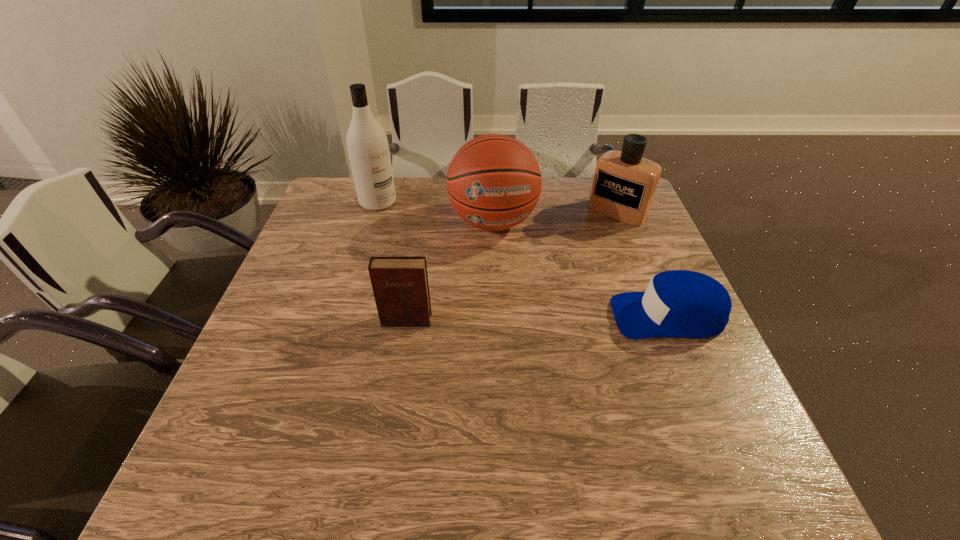
Where is `basketball positioned at the far edge`? basketball positioned at the far edge is located at coordinates (494, 181).

The width and height of the screenshot is (960, 540). In order to click on perfume located at the far edge in this screenshot , I will do pos(624,185).

This screenshot has width=960, height=540. I want to click on shampoo present at the far edge, so click(368, 149).

Where is `object positioned at the left edge`? The width and height of the screenshot is (960, 540). object positioned at the left edge is located at coordinates (368, 149).

At what (x,y) coordinates should I click in order to perform the action: click on baseball cap situated at the right edge. Please return your answer as a coordinate pair (x, y). This screenshot has height=540, width=960. Looking at the image, I should click on (678, 303).

At what (x,y) coordinates should I click in order to perform the action: click on perfume that is at the right edge. Please return your answer as a coordinate pair (x, y). The image size is (960, 540). Looking at the image, I should click on (624, 185).

The height and width of the screenshot is (540, 960). I want to click on object at the far left corner, so click(368, 149).

What are the coordinates of `object that is at the far right corner` in the screenshot? It's located at (624, 185).

Image resolution: width=960 pixels, height=540 pixels. In the image, there is a desktop. Find the location of `free space at the far edge`. free space at the far edge is located at coordinates (542, 186).

Locate an element on the screen. vacant area at the near edge of the desktop is located at coordinates (359, 410).